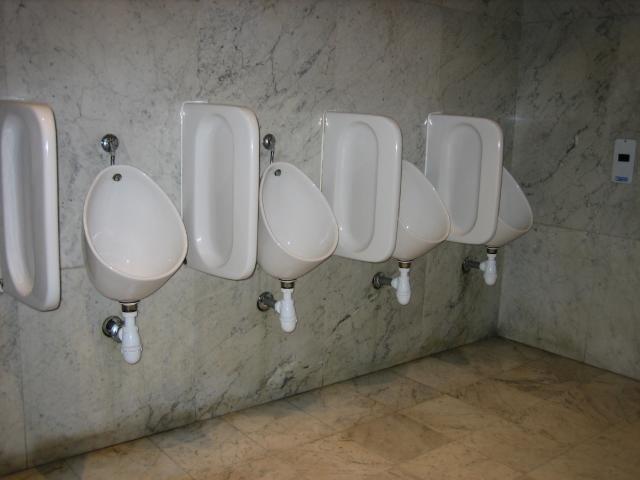
Image resolution: width=640 pixels, height=480 pixels. I want to click on deviders stalls, so click(x=29, y=181), click(x=210, y=176), click(x=347, y=159), click(x=459, y=157).